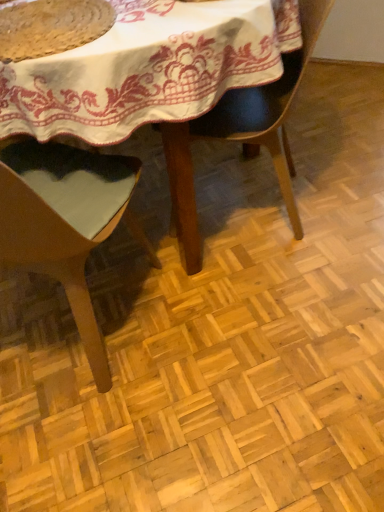
The height and width of the screenshot is (512, 384). In order to click on spots to the right of light brown wood chair at center, arranged as the second chair when viewed from the right in this screenshot , I will do `click(228, 323)`.